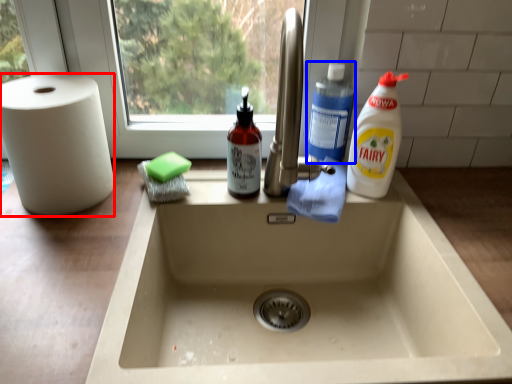
Question: Among these objects, which one is farthest to the camera, paper towel (highlighted by a red box) or cleaning product (highlighted by a blue box)?

Choices:
 (A) paper towel
 (B) cleaning product

Answer: (B)